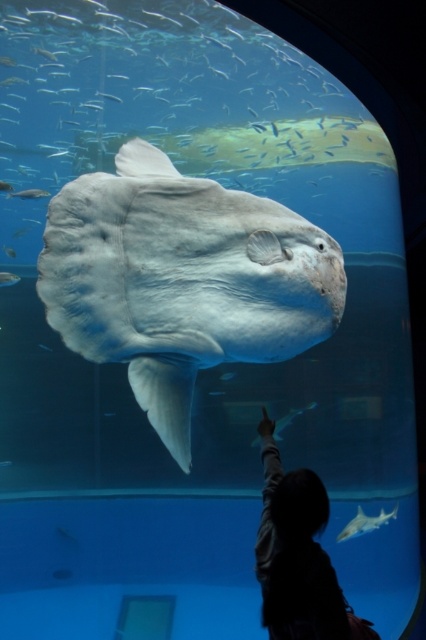
Between silhouette fabric at lower center and smooth gray shark at center, which one appears on the right side from the viewer's perspective?

smooth gray shark at center

Does silhouette fabric at lower center have a greater width compared to smooth gray shark at center?

No, silhouette fabric at lower center is not wider than smooth gray shark at center.

Find the location of `silhouette fabric at lower center`. silhouette fabric at lower center is located at coordinates (298, 556).

Measure the distance between point (121,195) and camera.

The distance of point (121,195) from camera is 10.79 feet.

Does white smooth sunfish at center have a larger size compared to smooth gray shark at center?

Indeed, white smooth sunfish at center has a larger size compared to smooth gray shark at center.

You are a GUI agent. You are given a task and a screenshot of the screen. Output one action in this format:
    pyautogui.click(x=<x>, y=<y>)
    Task: Click on the white smooth sunfish at center
    The width and height of the screenshot is (426, 640).
    Given the screenshot: What is the action you would take?
    pyautogui.click(x=181, y=280)

Between silhouette fabric at lower center and translucent white fish at upper center, which one is positioned higher?

translucent white fish at upper center

Is point (278, 488) positioned behind point (0, 284)?

That is False.

You are a GUI agent. You are given a task and a screenshot of the screen. Output one action in this format:
    pyautogui.click(x=<x>, y=<y>)
    Task: Click on the silhouette fabric at lower center
    
    Given the screenshot: What is the action you would take?
    pyautogui.click(x=298, y=556)